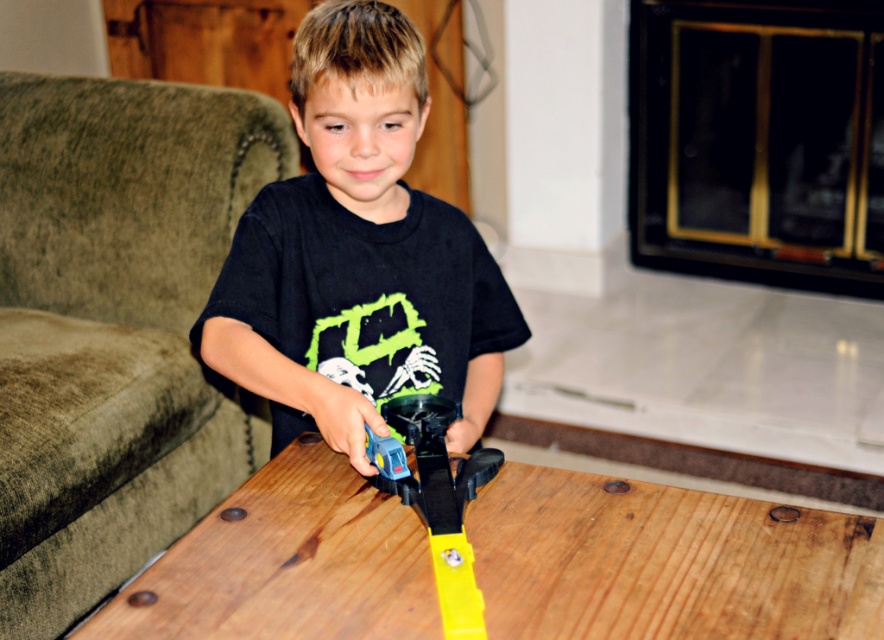
You are a parent trying to place a 90 cm long gift box on the wooden table at center. Can the gift box fit on the table?

The wooden table at center is 87.47 centimeters away from the viewer, but this distance does not indicate the table length. The question about fitting a 90 cm gift box cannot be answered with the provided information.

In the scene shown: You are standing in the living room and want to sit on the velvet green couch at left. Based on its position, which direction should you walk to reach it?

The velvet green couch at left is located at point [113,324], so you should walk towards the left side of the frame to reach it.

You are a delivery robot that needs to place a package between the velvet green couch at left and the black matte shirt at center. The package is 24 inches wide. Can it fit in the space between them?

The velvet green couch at left and black matte shirt at center are 25.20 inches apart from each other. Since the package is 24 inches wide, it can fit in the space between them as there is enough clearance.